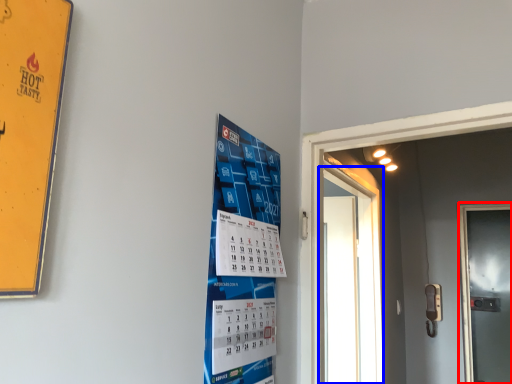
Question: Which of the following is the closest to the observer, door (highlighted by a red box) or door (highlighted by a blue box)?

Choices:
 (A) door
 (B) door

Answer: (B)